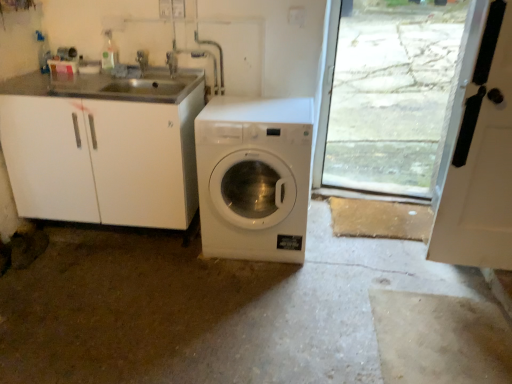
The height and width of the screenshot is (384, 512). Find the location of `vacant space situated on the left part of brushed metal faucet at upper center, which is counted as the first faucet, starting from the right`. vacant space situated on the left part of brushed metal faucet at upper center, which is counted as the first faucet, starting from the right is located at coordinates (145, 81).